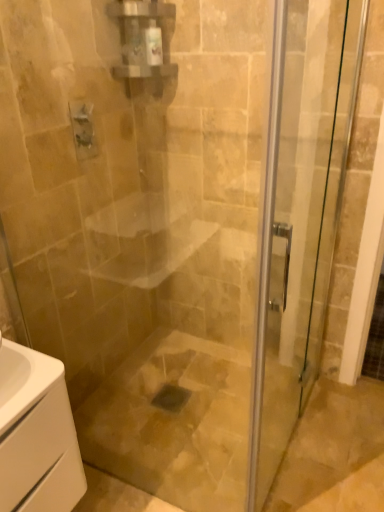
Measure the distance between point (256,505) and camera.

A distance of 1.48 meters exists between point (256,505) and camera.

This screenshot has width=384, height=512. What do you see at coordinates (300, 212) in the screenshot? I see `transparent glass door at center` at bounding box center [300, 212].

What is the approximate width of matte silver faucet at upper left?

The width of matte silver faucet at upper left is 4.07 centimeters.

Image resolution: width=384 pixels, height=512 pixels. Describe the element at coordinates (37, 434) in the screenshot. I see `white glossy cabinet at lower left` at that location.

The width and height of the screenshot is (384, 512). What are the coordinates of `transparent glass door at center` in the screenshot? It's located at (300, 212).

Who is bigger, matte silver faucet at upper left or white glossy cabinet at lower left?

With larger size is white glossy cabinet at lower left.

Where is `shower above the white glossy cabinet at lower left (from a real-world perspective)`? This screenshot has height=512, width=384. shower above the white glossy cabinet at lower left (from a real-world perspective) is located at coordinates (83, 130).

Can you confirm if matte silver faucet at upper left is wider than white glossy cabinet at lower left?

No, matte silver faucet at upper left is not wider than white glossy cabinet at lower left.

How much distance is there between matte silver faucet at upper left and white glossy cabinet at lower left?

matte silver faucet at upper left is 38.40 inches away from white glossy cabinet at lower left.

Is white glossy cabinet at lower left bigger or smaller than transparent glass door at center?

Clearly, white glossy cabinet at lower left is smaller in size than transparent glass door at center.

Are white glossy cabinet at lower left and transparent glass door at center far apart?

No, white glossy cabinet at lower left is not far away from transparent glass door at center.

Considering their positions, is white glossy cabinet at lower left located in front of or behind transparent glass door at center?

white glossy cabinet at lower left is positioned farther from the viewer than transparent glass door at center.

From the picture: Considering the sizes of white glossy cabinet at lower left and transparent glass door at center in the image, is white glossy cabinet at lower left taller or shorter than transparent glass door at center?

Clearly, white glossy cabinet at lower left is shorter compared to transparent glass door at center.

How much distance is there between transparent glass door at center and white glossy cabinet at lower left?

transparent glass door at center and white glossy cabinet at lower left are 30.66 inches apart from each other.

In order to click on bathroom cabinet on the left of the transparent glass door at center in this screenshot , I will do `click(37, 434)`.

From a real-world perspective, between transparent glass door at center and white glossy cabinet at lower left, who is vertically lower?

white glossy cabinet at lower left, from a real-world perspective.

Between transparent glass door at center and white glossy cabinet at lower left, which one has larger size?

transparent glass door at center is bigger.

From a real-world perspective, is white glossy cabinet at lower left physically below matte silver faucet at upper left?

Yes, from a real-world perspective, white glossy cabinet at lower left is under matte silver faucet at upper left.

Which is more to the right, white glossy cabinet at lower left or matte silver faucet at upper left?

Positioned to the right is matte silver faucet at upper left.

Is white glossy cabinet at lower left aimed at matte silver faucet at upper left?

No, white glossy cabinet at lower left is not oriented towards matte silver faucet at upper left.

Considering the sizes of objects transparent glass door at center and matte silver faucet at upper left in the image provided, who is thinner, transparent glass door at center or matte silver faucet at upper left?

matte silver faucet at upper left.

How many degrees apart are the facing directions of transparent glass door at center and matte silver faucet at upper left?

They differ by 2 degrees in their facing directions.

Considering the positions of points (265, 209) and (83, 118), is point (265, 209) closer to camera compared to point (83, 118)?

Yes, point (265, 209) is closer to viewer.

Based on the photo, from the image's perspective, between matte silver faucet at upper left and transparent glass door at center, who is located below?

transparent glass door at center is shown below in the image.

Looking at this image, is matte silver faucet at upper left turned away from transparent glass door at center?

matte silver faucet at upper left does not have its back to transparent glass door at center.

Based on the photo, considering the sizes of matte silver faucet at upper left and transparent glass door at center in the image, is matte silver faucet at upper left taller or shorter than transparent glass door at center?

matte silver faucet at upper left is shorter than transparent glass door at center.

Considering the positions of objects matte silver faucet at upper left and transparent glass door at center in the image provided, who is behind, matte silver faucet at upper left or transparent glass door at center?

matte silver faucet at upper left.

Identify the location of shower on the right of white glossy cabinet at lower left. click(83, 130).

The image size is (384, 512). Identify the location of door above the white glossy cabinet at lower left (from a real-world perspective). (300, 212).

Considering their positions, is matte silver faucet at upper left positioned further to transparent glass door at center than white glossy cabinet at lower left?

Among the two, matte silver faucet at upper left is located further to transparent glass door at center.

Looking at the image, which one is located further to white glossy cabinet at lower left, transparent glass door at center or matte silver faucet at upper left?

The object further to white glossy cabinet at lower left is matte silver faucet at upper left.

From the image, which object appears to be nearer to matte silver faucet at upper left, white glossy cabinet at lower left or transparent glass door at center?

Among the two, transparent glass door at center is located nearer to matte silver faucet at upper left.

Based on their spatial positions, is transparent glass door at center or white glossy cabinet at lower left closer to matte silver faucet at upper left?

transparent glass door at center.

From the image, which object appears to be nearer to transparent glass door at center, white glossy cabinet at lower left or matte silver faucet at upper left?

white glossy cabinet at lower left lies closer to transparent glass door at center than the other object.

From the image, which object appears to be farther from white glossy cabinet at lower left, matte silver faucet at upper left or transparent glass door at center?

matte silver faucet at upper left lies further to white glossy cabinet at lower left than the other object.

Locate an element on the screen. This screenshot has height=512, width=384. door between matte silver faucet at upper left and white glossy cabinet at lower left vertically is located at coordinates (300, 212).